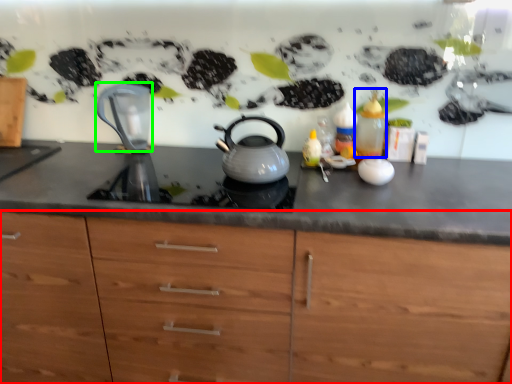
Question: Estimate the real-world distances between objects in this image. Which object is farther from cabinetry (highlighted by a red box), bottle (highlighted by a blue box) or jug (highlighted by a green box)?

Choices:
 (A) bottle
 (B) jug

Answer: (B)